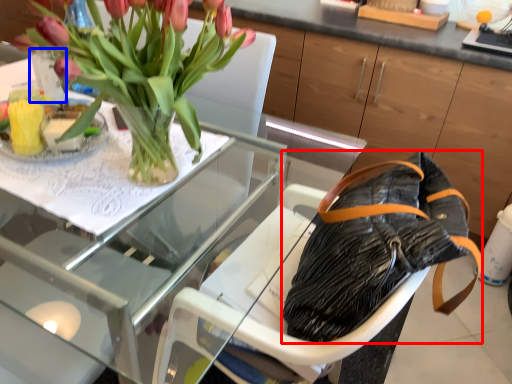
Question: Among these objects, which one is nearest to the camera, handbag (highlighted by a red box) or glass vase (highlighted by a blue box)?

Choices:
 (A) handbag
 (B) glass vase

Answer: (A)